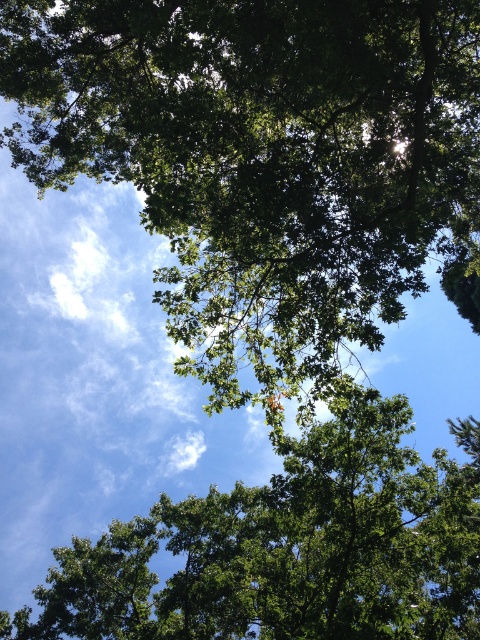
Describe the element at coordinates (262, 160) in the screenshot. The width and height of the screenshot is (480, 640). I see `green leafy tree at upper center` at that location.

Is point (352, 211) positioned before point (320, 438)?

Yes, point (352, 211) is closer to viewer.

Identify the location of green leafy tree at upper center. (262, 160).